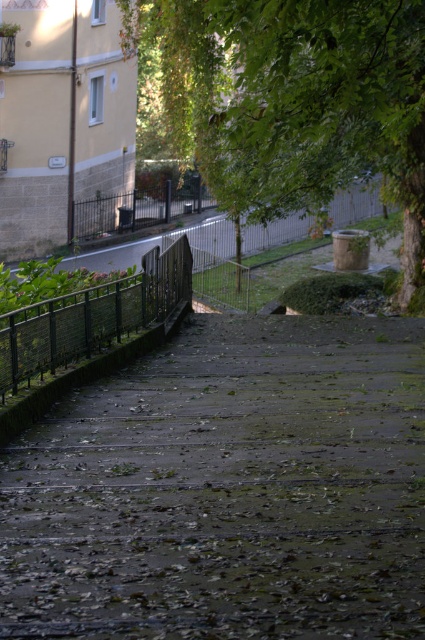
You are standing at the top of the dark gray concrete stairs at center. What are the coordinates of the stairs?

The dark gray concrete stairs at center are located at coordinates point (226,490).

You are standing at the bottom of the staircase and want to look up towards the top. Which object would you see first as you look upward, the green leafy tree at upper center or the green metal fence at left?

The green leafy tree at upper center would be seen first because it is positioned to the right of the green metal fence at left, placing it in a more central and higher position along the line of sight.

You are a painter who needs to paint the green metal fence at left and the green leafy tree at upper center. Which object will require more paint due to its size?

The green leafy tree at upper center will require more paint because it is bigger than the green metal fence at left.